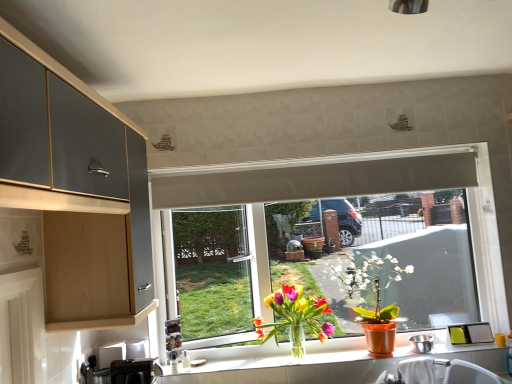
Identify the location of free point above white matte exhaust hood at upper center (from a real-world perspective). (287, 168).